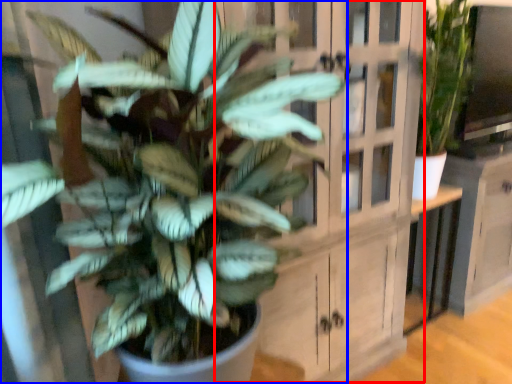
Question: Which object is closer to the camera taking this photo, dresser (highlighted by a red box) or houseplant (highlighted by a blue box)?

Choices:
 (A) dresser
 (B) houseplant

Answer: (B)